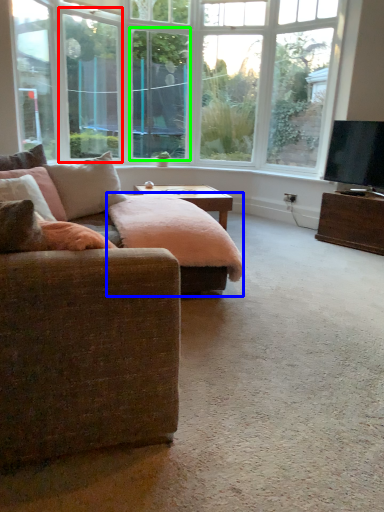
Question: Based on their relative distances, which object is farther from window screen (highlighted by a red box)? Choose from swivel chair (highlighted by a blue box) and window screen (highlighted by a green box).

Choices:
 (A) swivel chair
 (B) window screen

Answer: (A)